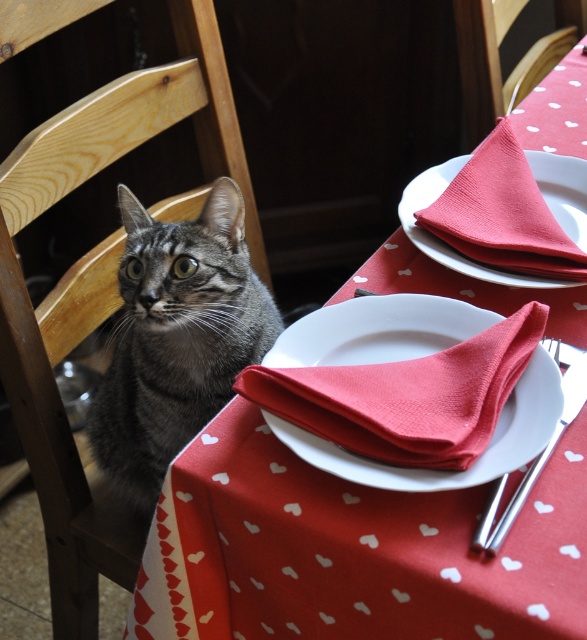
Question: Which of the following is the farthest from the observer?

Choices:
 (A) (163, 308)
 (B) (541, 355)
 (C) (490, 40)
 (D) (511, 284)

Answer: (C)

Question: Does wooden chair at left appear over gray tabby cat at left?

Choices:
 (A) no
 (B) yes

Answer: (B)

Question: Which of the following is the closest to the observer?

Choices:
 (A) (104, 120)
 (B) (248, 364)

Answer: (B)

Question: Is wooden chair at left to the right of smooth white plate at center from the viewer's perspective?

Choices:
 (A) no
 (B) yes

Answer: (A)

Question: Does smooth white plate at center lie in front of wooden chair at upper right?

Choices:
 (A) yes
 (B) no

Answer: (A)

Question: Estimate the real-world distances between objects in this image. Which object is farther from the red paper napkin at center?

Choices:
 (A) wooden chair at upper right
 (B) shiny metallic fork at lower right

Answer: (A)